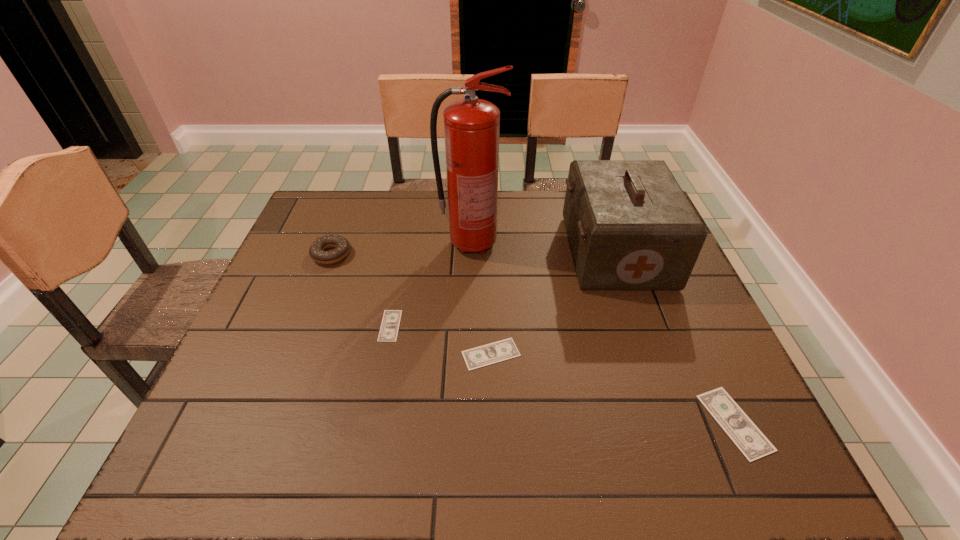
At what (x,y) coordinates should I click in order to perform the action: click on the leftmost money. Please return your answer as a coordinate pair (x, y). The height and width of the screenshot is (540, 960). Looking at the image, I should click on (389, 328).

Find the location of `the shortest object`. the shortest object is located at coordinates (389, 328).

Where is `the second shortest object`? the second shortest object is located at coordinates (499, 351).

Locate an element on the screen. the second money from right to left is located at coordinates (499, 351).

Locate an element on the screen. This screenshot has height=540, width=960. the rightmost money is located at coordinates (752, 443).

Where is `the third shortest object`? This screenshot has width=960, height=540. the third shortest object is located at coordinates point(752,443).

Where is `the tallest object`? Image resolution: width=960 pixels, height=540 pixels. the tallest object is located at coordinates (471, 126).

Locate an element on the screen. This screenshot has width=960, height=540. the second tallest object is located at coordinates [x=630, y=226].

At what (x,y) coordinates should I click in order to perform the action: click on the third tallest object. Please return your answer as a coordinate pair (x, y). Image resolution: width=960 pixels, height=540 pixels. Looking at the image, I should click on (317, 249).

This screenshot has width=960, height=540. I want to click on doughnut, so click(317, 249).